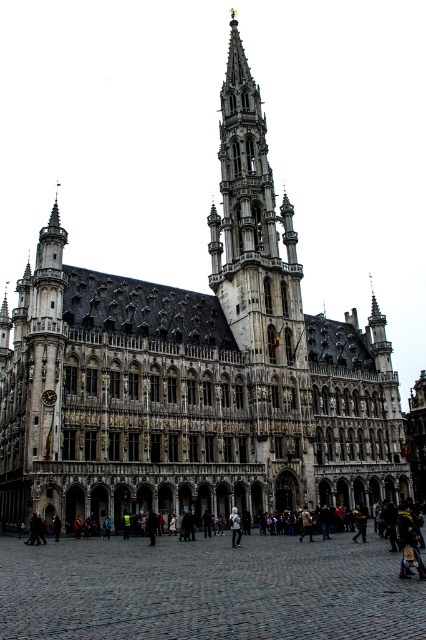
Between point (229, 548) and point (233, 516), which one is positioned behind?

The point (233, 516) is behind.

Does point (203, 532) lie behind point (232, 532)?

Yes, it is behind point (232, 532).

Is point (134, 595) closer to camera compared to point (235, 547)?

Yes, point (134, 595) is closer to viewer.

Find the location of `dark clothing at center`. dark clothing at center is located at coordinates (213, 568).

Does point (135, 624) come in front of point (233, 520)?

Yes, it is.

Between point (304, 563) and point (233, 516), which one is positioned behind?

The point (233, 516) is more distant.

Is point (265, 621) closer to viewer compared to point (239, 518)?

Yes, point (265, 621) is in front of point (239, 518).

The height and width of the screenshot is (640, 426). I want to click on brown cobblestone at center, so click(207, 589).

Which is in front, point (267, 589) or point (319, 554)?

Point (267, 589) is in front.

Identify the location of brown cobblestone at center. (207, 589).